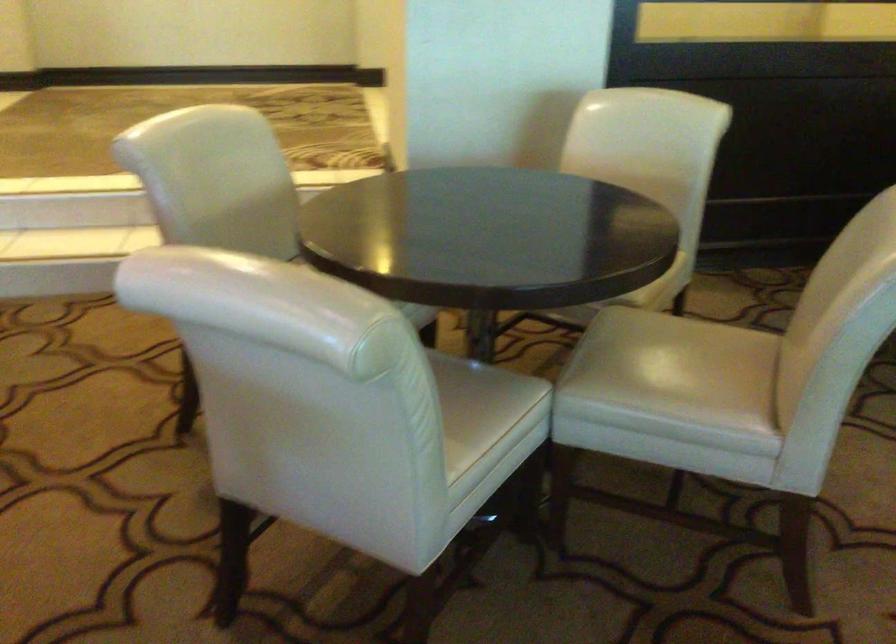
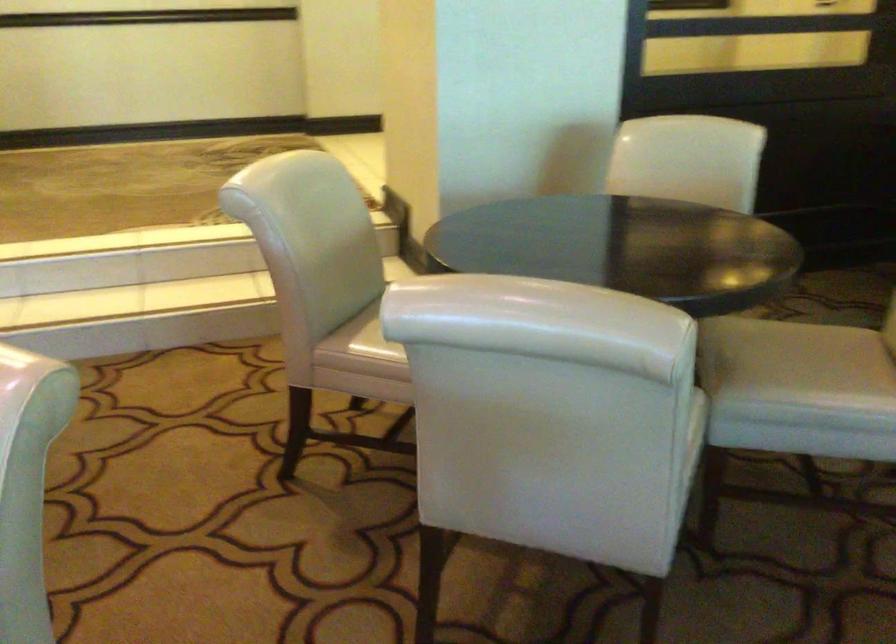
Locate, in the second image, the point that corresponds to [664,368] in the first image.

(796, 363)